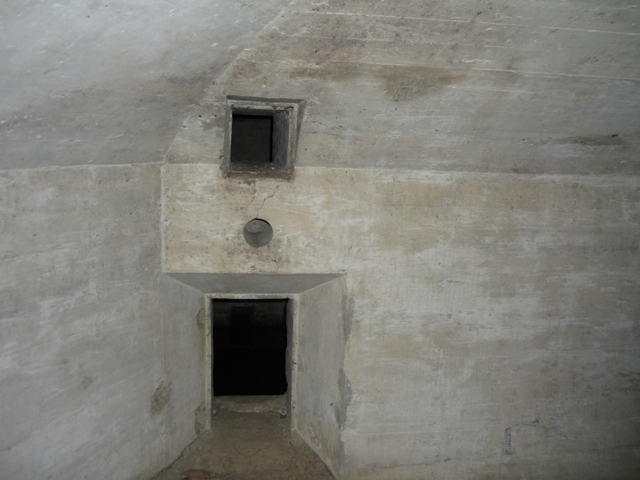
At what (x,y) coordinates should I click in order to perform the action: click on floor. Please return your answer as a coordinate pair (x, y). The height and width of the screenshot is (480, 640). Looking at the image, I should click on (246, 461).